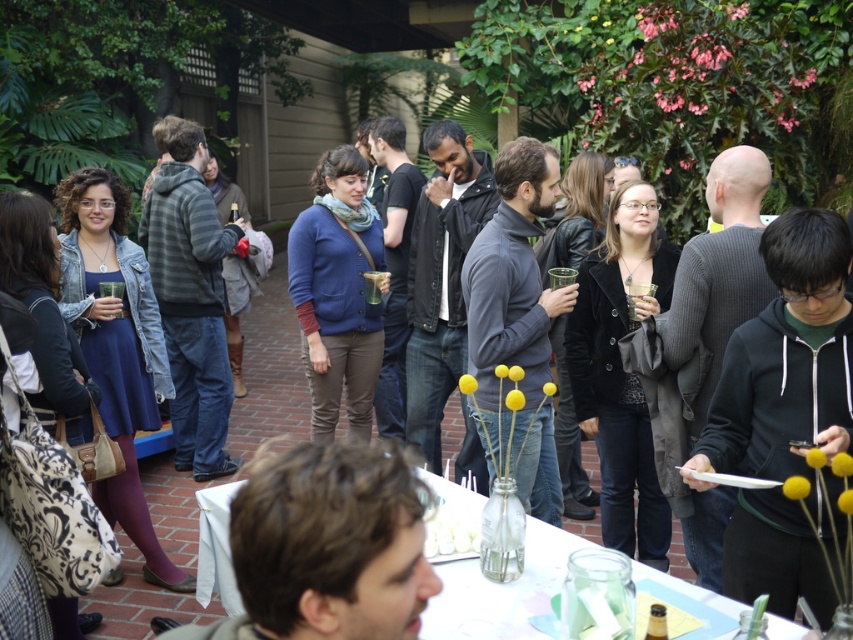
Find the location of a particular element. The width and height of the screenshot is (853, 640). white paper plate at center is located at coordinates (500, 589).

Is white paper plate at center further to the viewer compared to white frosted cake at center?

No, white paper plate at center is closer to the viewer.

The image size is (853, 640). Describe the element at coordinates (500, 589) in the screenshot. I see `white paper plate at center` at that location.

This screenshot has width=853, height=640. Identify the location of white paper plate at center. (500, 589).